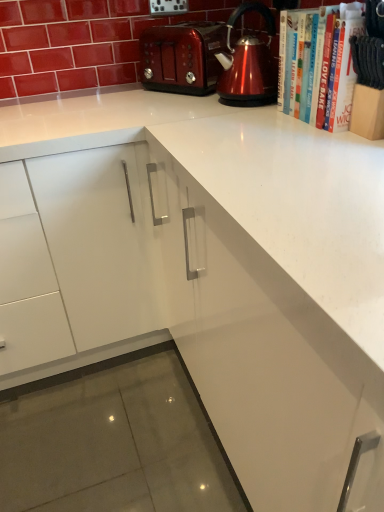
I want to click on unoccupied area in front of shiny metallic toaster at upper center, so click(x=174, y=108).